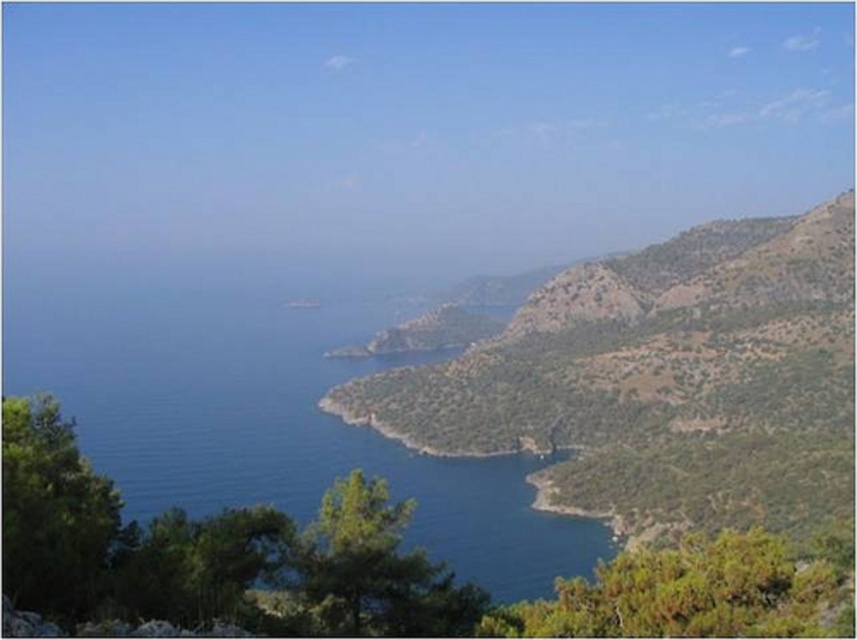
Question: Is green textured mountain at center-right smaller than blue water at center?

Choices:
 (A) no
 (B) yes

Answer: (B)

Question: Does green textured mountain at center-right appear under blue water at center?

Choices:
 (A) yes
 (B) no

Answer: (A)

Question: Among these objects, which one is nearest to the camera?

Choices:
 (A) green textured mountain at center-right
 (B) blue water at center

Answer: (B)

Question: Which point appears closest to the camera in this image?

Choices:
 (A) (535, 342)
 (B) (492, 577)

Answer: (B)

Question: Can you confirm if green textured mountain at center-right is smaller than blue water at center?

Choices:
 (A) no
 (B) yes

Answer: (B)